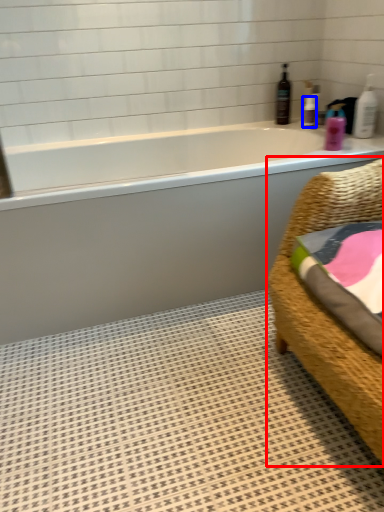
Question: Which point is closer to the camera, furniture (highlighted by a red box) or toiletry (highlighted by a blue box)?

Choices:
 (A) furniture
 (B) toiletry

Answer: (A)